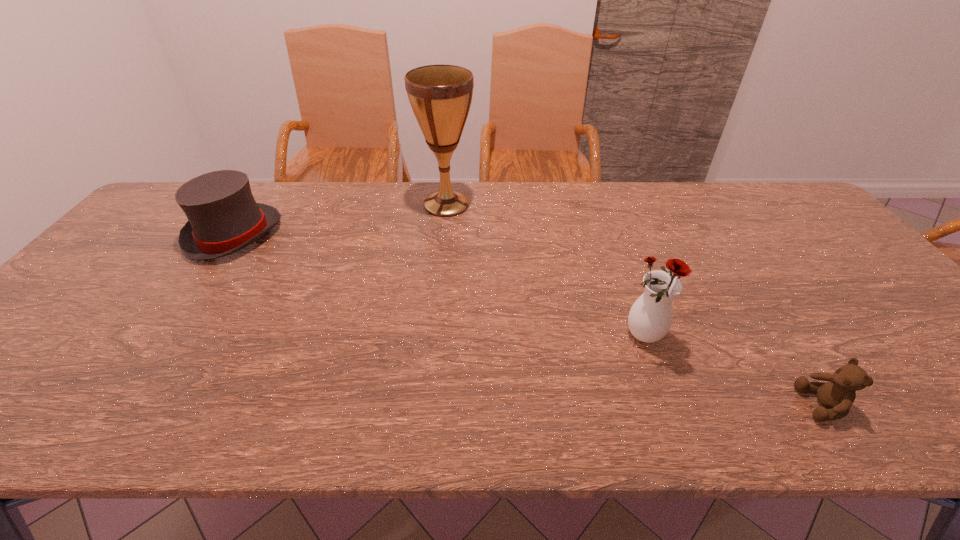
Locate an element on the screen. vacant region located 0.050m on the left of the leftmost object is located at coordinates (173, 235).

This screenshot has width=960, height=540. What are the coordinates of `free space located on the front-facing side of the shortest object` in the screenshot? It's located at (678, 404).

Where is `blank space located on the front-facing side of the shortest object`? Image resolution: width=960 pixels, height=540 pixels. blank space located on the front-facing side of the shortest object is located at coordinates (693, 404).

Where is `vacant area located 0.060m on the front-facing side of the shortest object`? The image size is (960, 540). vacant area located 0.060m on the front-facing side of the shortest object is located at coordinates (772, 404).

This screenshot has width=960, height=540. In order to click on trophy cup present at the far edge in this screenshot , I will do `click(440, 95)`.

The width and height of the screenshot is (960, 540). Identify the location of dress hat that is at the far edge. (223, 215).

You are a GUI agent. You are given a task and a screenshot of the screen. Output one action in this format:
    pyautogui.click(x=<x>, y=<y>)
    Task: Click on the object present at the near edge
    The height and width of the screenshot is (540, 960).
    Given the screenshot: What is the action you would take?
    pyautogui.click(x=836, y=396)

Locate an element on the screen. vacant space at the far edge of the desktop is located at coordinates (617, 187).

The image size is (960, 540). Identify the location of vacant space at the left edge. (19, 345).

In the image, there is a desktop. Where is `blank space at the right edge`? blank space at the right edge is located at coordinates (781, 228).